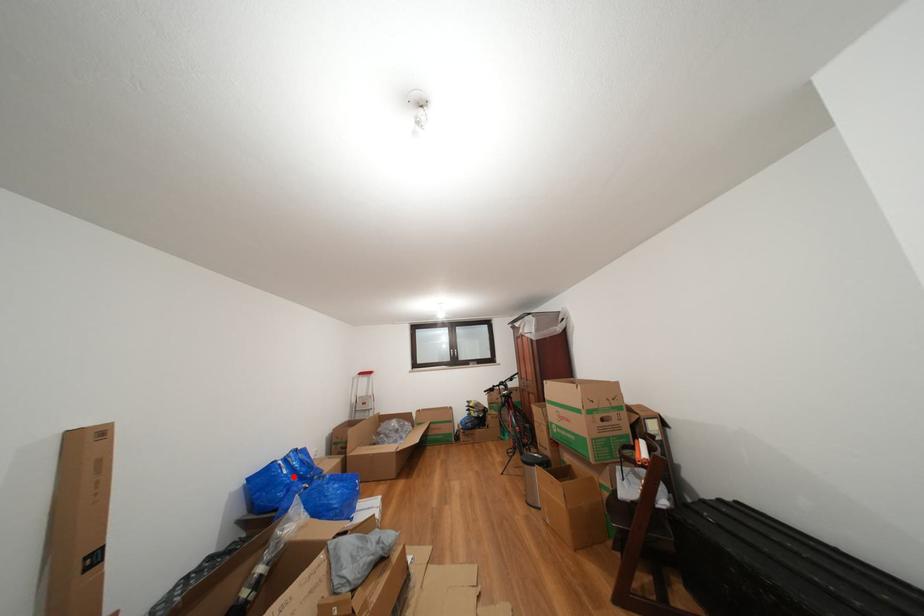
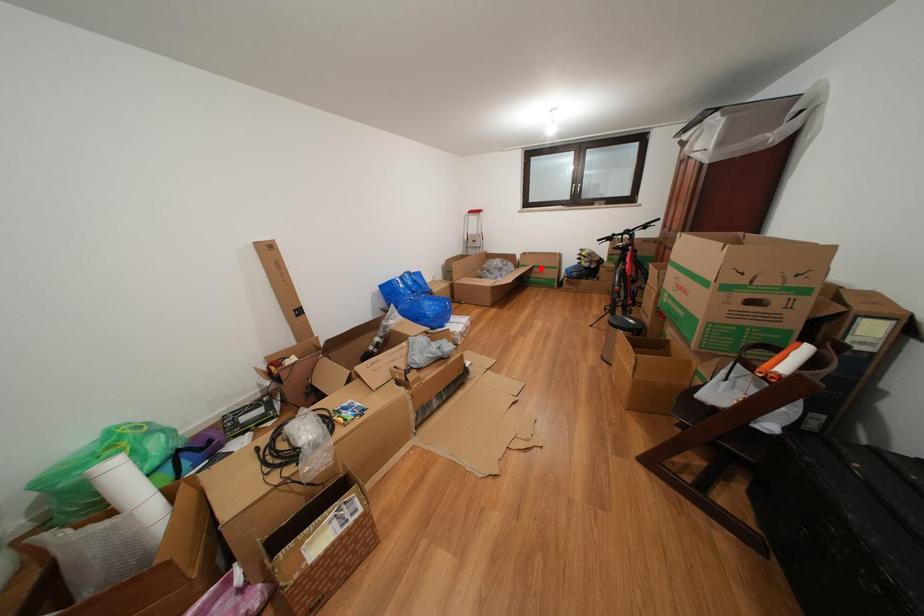
I am providing you with two images of the same scene from different viewpoints. A red point is marked on the first image and another point is marked on the second image. Do the highlighted points in image1 and image2 indicate the same real-world spot?

No